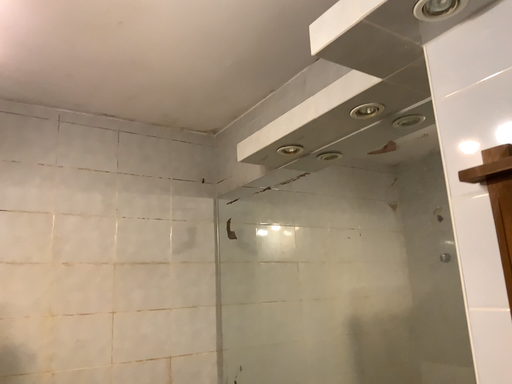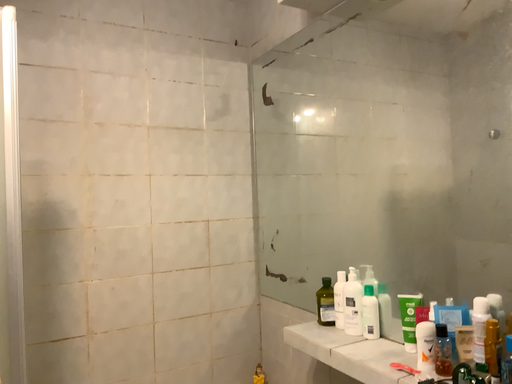
Question: How did the camera likely rotate when shooting the video?

Choices:
 (A) rotated upward
 (B) rotated downward

Answer: (B)